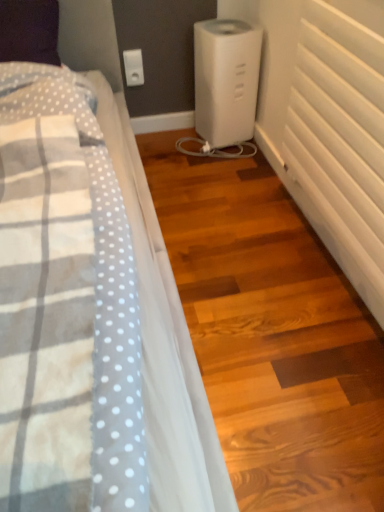
Question: Considering the relative sizes of white plastic electric outlet at upper center and white matte radiator at right in the image provided, is white plastic electric outlet at upper center bigger than white matte radiator at right?

Choices:
 (A) no
 (B) yes

Answer: (A)

Question: Considering the relative sizes of white plastic electric outlet at upper center and white matte radiator at right in the image provided, is white plastic electric outlet at upper center smaller than white matte radiator at right?

Choices:
 (A) yes
 (B) no

Answer: (A)

Question: From the image's perspective, does white plastic electric outlet at upper center appear higher than white matte radiator at right?

Choices:
 (A) no
 (B) yes

Answer: (B)

Question: Can you see white plastic electric outlet at upper center touching white matte radiator at right?

Choices:
 (A) yes
 (B) no

Answer: (B)

Question: Can you confirm if white plastic electric outlet at upper center is thinner than white matte radiator at right?

Choices:
 (A) no
 (B) yes

Answer: (B)

Question: In terms of width, does white plastic humidifier at center look wider or thinner when compared to white matte radiator at right?

Choices:
 (A) thin
 (B) wide

Answer: (B)

Question: Considering their positions, is white plastic humidifier at center located in front of or behind white matte radiator at right?

Choices:
 (A) behind
 (B) front

Answer: (A)

Question: Considering the positions of white plastic humidifier at center and white matte radiator at right in the image, is white plastic humidifier at center taller or shorter than white matte radiator at right?

Choices:
 (A) short
 (B) tall

Answer: (A)

Question: From a real-world perspective, is white plastic humidifier at center above or below white matte radiator at right?

Choices:
 (A) below
 (B) above

Answer: (A)

Question: Is white plastic electric outlet at upper center wider or thinner than white matte radiator at right?

Choices:
 (A) wide
 (B) thin

Answer: (B)

Question: Considering the relative positions of white plastic electric outlet at upper center and white matte radiator at right in the image provided, is white plastic electric outlet at upper center to the left or to the right of white matte radiator at right?

Choices:
 (A) right
 (B) left

Answer: (B)

Question: From a real-world perspective, is white plastic electric outlet at upper center above or below white matte radiator at right?

Choices:
 (A) above
 (B) below

Answer: (B)

Question: Is white plastic electric outlet at upper center taller or shorter than white matte radiator at right?

Choices:
 (A) tall
 (B) short

Answer: (B)

Question: Considering the positions of point (367, 205) and point (218, 115), is point (367, 205) closer or farther from the camera than point (218, 115)?

Choices:
 (A) farther
 (B) closer

Answer: (B)

Question: From the image's perspective, is white matte radiator at right located above or below white plastic humidifier at center?

Choices:
 (A) below
 (B) above

Answer: (A)